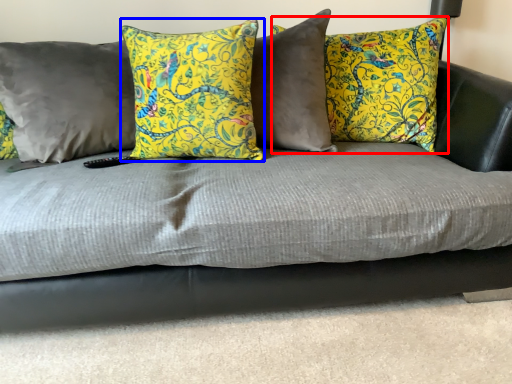
Question: Which object is further to the camera taking this photo, pillow (highlighted by a red box) or pillow (highlighted by a blue box)?

Choices:
 (A) pillow
 (B) pillow

Answer: (A)